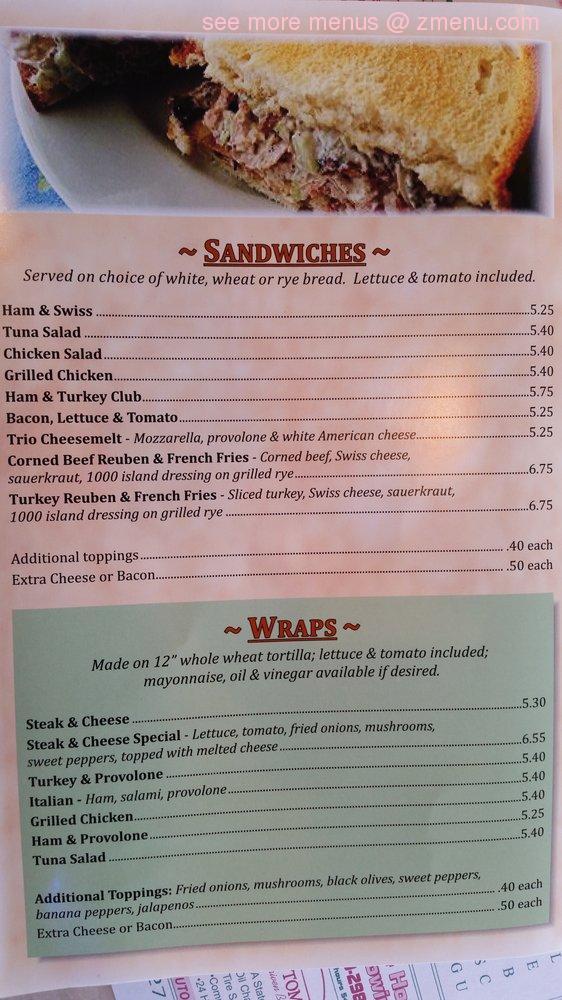
I want to click on plate, so click(128, 142).